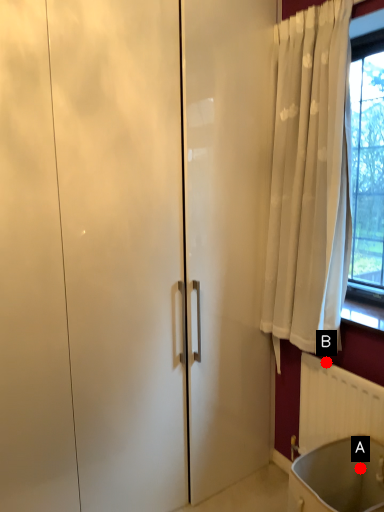
Question: Two points are circled on the image, labeled by A and B beside each circle. Among these points, which one is nearest to the camera?

Choices:
 (A) A is closer
 (B) B is closer

Answer: (A)